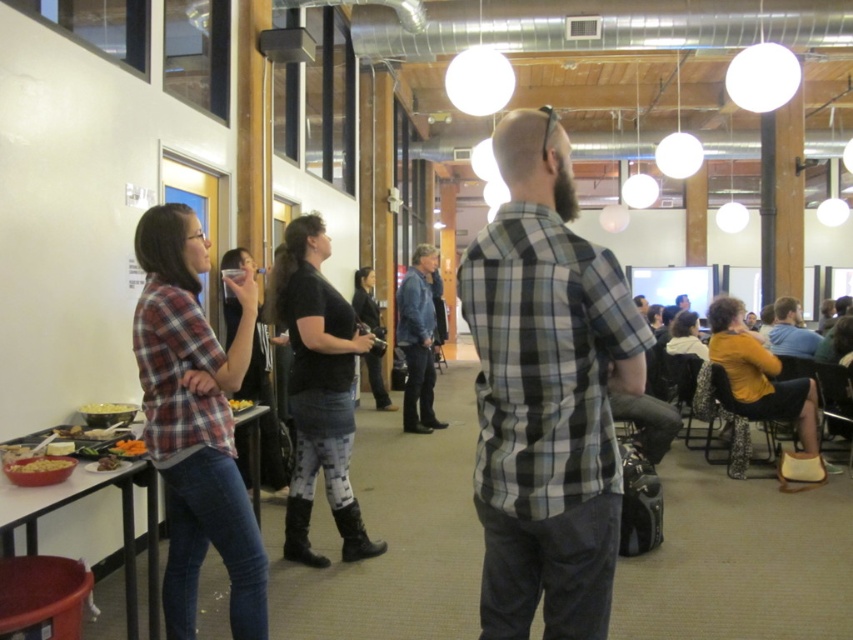
Question: Which of the following is the farthest from the observer?

Choices:
 (A) smooth brown bowl at lower left
 (B) matte orange snack at lower left
 (C) plaid flannel shirt at left

Answer: (A)

Question: Among these objects, which one is farthest from the camera?

Choices:
 (A) wooden table at left
 (B) matte orange snack at lower left

Answer: (B)

Question: Can you confirm if black matte boots at center is positioned above matte orange snack at lower left?

Choices:
 (A) yes
 (B) no

Answer: (A)

Question: Among these objects, which one is farthest from the camera?

Choices:
 (A) matte yellow popcorn at lower left
 (B) matte plastic bowl at lower left

Answer: (A)

Question: Does plaid flannel shirt at left have a smaller size compared to matte yellow popcorn at lower left?

Choices:
 (A) yes
 (B) no

Answer: (B)

Question: Is matte orange snack at lower left to the left of yellow matte bowl at center from the viewer's perspective?

Choices:
 (A) yes
 (B) no

Answer: (A)